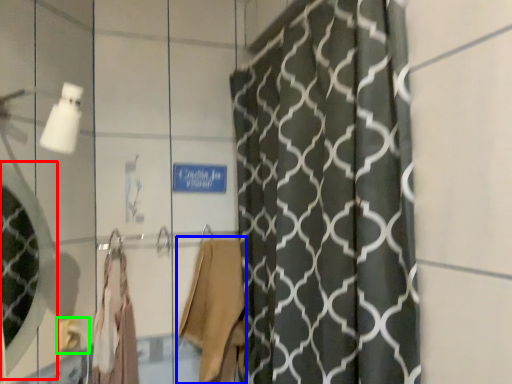
Question: Considering the real-world distances, which object is closest to mirror (highlighted by a red box)? robe (highlighted by a blue box) or towel bar (highlighted by a green box).

Choices:
 (A) robe
 (B) towel bar

Answer: (B)